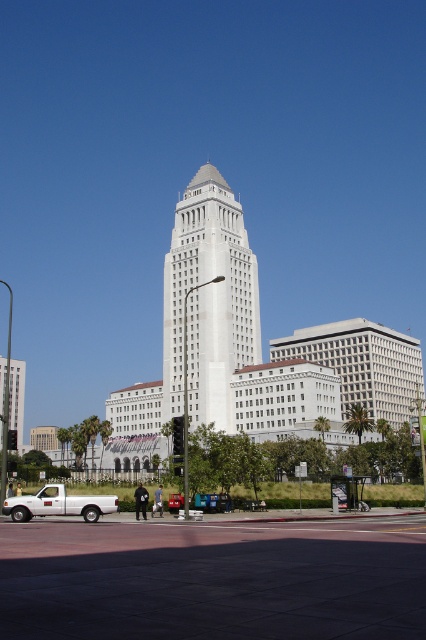
You are a photographer trying to capture the white smooth tower at center and the white matte truck at lower left in a single shot. Considering their positions and sizes, which object will appear taller in your photo?

The white smooth tower at center will appear taller in the photo because it has a greater height compared to the white matte truck at lower left.

You are a photographer planning to take a photo of the white smooth tower at center and the white matte truck at lower left. You want to ensure both are in the frame. Considering their sizes, which object might require you to adjust your camera angle to include its full width?

The white smooth tower at center might be wider than the white matte truck at lower left, so you might need to adjust your camera angle to capture its full width.

You are a photographer standing in front of the white smooth tower at center and the white matte truck at lower left. You want to capture a photo that includes both objects in the frame. Based on their positions, which object should you focus on first to ensure both are visible?

The white smooth tower at center is above the white matte truck at lower left, so you should focus on the white matte truck at lower left first to ensure both are visible in the frame.